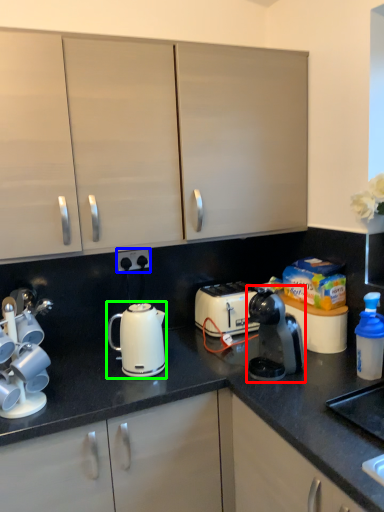
Question: Which object is the closest to the home appliance (highlighted by a red box)? Choose among these: electric outlet (highlighted by a blue box) or kettle (highlighted by a green box).

Choices:
 (A) electric outlet
 (B) kettle

Answer: (B)